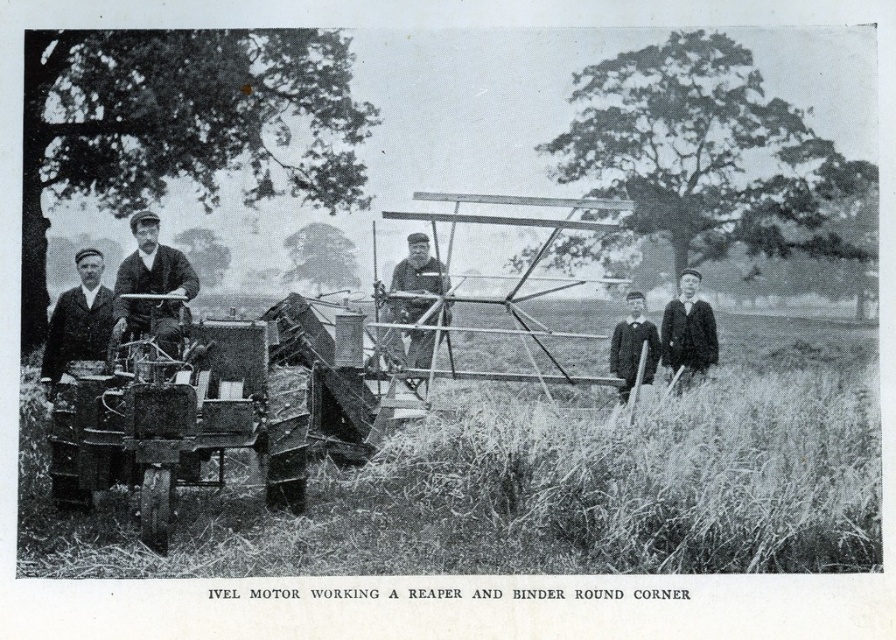
Question: Which of the following is the farthest from the observer?

Choices:
 (A) smooth wood chair at center
 (B) smooth leather jacket at center

Answer: (A)

Question: Is smooth fabric suit at left positioned behind dark woolen sweater at center?

Choices:
 (A) yes
 (B) no

Answer: (B)

Question: Which object is positioned farthest from the smooth fabric suit at left?

Choices:
 (A) smooth leather jacket at center
 (B) smooth wood chair at center

Answer: (B)

Question: Can you confirm if smooth leather jacket at center is positioned to the left of smooth black suit at right?

Choices:
 (A) no
 (B) yes

Answer: (B)

Question: Which of the following is the farthest from the observer?

Choices:
 (A) smooth fabric suit at left
 (B) smooth wood chair at center

Answer: (A)

Question: Does smooth fabric suit at left lie behind smooth wood chair at center?

Choices:
 (A) yes
 (B) no

Answer: (A)